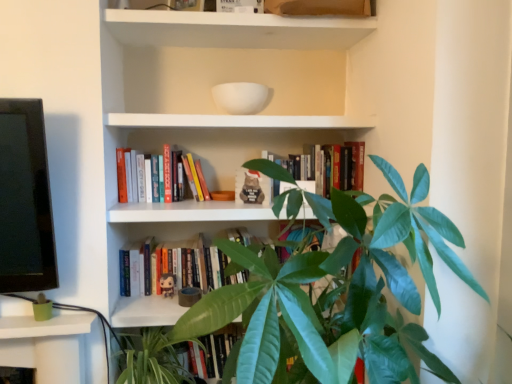
Describe the element at coordinates (333, 291) in the screenshot. I see `green glossy houseplant at center` at that location.

Find the location of `green leafy plant at lower center`. green leafy plant at lower center is located at coordinates click(151, 359).

At what (x,y) coordinates should I click in order to perform the action: click on green glossy houseplant at center. Please return your answer as a coordinate pair (x, y). Looking at the image, I should click on (333, 291).

Can you confirm if hardcover book at center, which is the 3th book from top to bottom, is taller than green glossy houseplant at center?

In fact, hardcover book at center, which is the 3th book from top to bottom, may be shorter than green glossy houseplant at center.

Is hardcover book at center, which is the 1th book in bottom-to-top order, not close to green glossy houseplant at center?

hardcover book at center, which is the 1th book in bottom-to-top order, is near green glossy houseplant at center, not far away.

Can you tell me how much hardcover book at center, which is the 3th book from top to bottom, and green glossy houseplant at center differ in facing direction?

88.2 degrees.

Is hardcover book at center, which is the 3th book from top to bottom, positioned before green glossy houseplant at center?

No, the depth of hardcover book at center, which is the 3th book from top to bottom, is greater than that of green glossy houseplant at center.

Considering the sizes of objects green leafy plant at lower center and green glossy houseplant at center in the image provided, who is shorter, green leafy plant at lower center or green glossy houseplant at center?

With less height is green leafy plant at lower center.

Is green leafy plant at lower center wider or thinner than green glossy houseplant at center?

Considering their sizes, green leafy plant at lower center looks slimmer than green glossy houseplant at center.

Would you consider green leafy plant at lower center to be distant from green glossy houseplant at center?

No.

Considering the points (161, 355) and (339, 325), which point is behind, point (161, 355) or point (339, 325)?

Positioned behind is point (161, 355).

Is hardcover books at center, which is counted as the second book, starting from the top, situated inside green leafy plant at lower center or outside?

hardcover books at center, which is counted as the second book, starting from the top, is not enclosed by green leafy plant at lower center.

Is hardcover books at center, which is the 2th book in bottom-to-top order, far from green leafy plant at lower center?

No.

Between hardcover books at center, which is counted as the second book, starting from the top, and green leafy plant at lower center, which one appears on the left side from the viewer's perspective?

hardcover books at center, which is counted as the second book, starting from the top, is more to the left.

Is green glossy houseplant at center oriented away from hardcover books at center, which is counted as the second book, starting from the top?

No, green glossy houseplant at center's orientation is not away from hardcover books at center, which is counted as the second book, starting from the top.

Between green glossy houseplant at center and hardcover books at center, which is the 2th book in bottom-to-top order, which one is positioned behind?

Positioned behind is hardcover books at center, which is the 2th book in bottom-to-top order.

Between green glossy houseplant at center and hardcover books at center, which is the 2th book in bottom-to-top order, which one has less height?

Standing shorter between the two is hardcover books at center, which is the 2th book in bottom-to-top order.

Which of these two, green glossy houseplant at center or hardcover books at center, which is the 2th book in bottom-to-top order, is bigger?

Bigger between the two is green glossy houseplant at center.

From a real-world perspective, which object rests below the other?

In real-world perspective, green glossy houseplant at center is lower.

Are hardcover books at center, positioned as the 3th book in bottom-to-top order, and green glossy houseplant at center located far from each other?

They are positioned close to each other.

The width and height of the screenshot is (512, 384). In order to click on houseplant that appears in front of the hardcover books at center, positioned as the 3th book in bottom-to-top order in this screenshot , I will do `click(333, 291)`.

Is hardcover book at center, which is the 3th book from top to bottom, completely or partially outside of green leafy plant at lower center?

hardcover book at center, which is the 3th book from top to bottom, lies outside green leafy plant at lower center's area.

Based on the photo, is hardcover book at center, which is the 1th book in bottom-to-top order, taller or shorter than green leafy plant at lower center?

Clearly, hardcover book at center, which is the 1th book in bottom-to-top order, is shorter compared to green leafy plant at lower center.

Where is `vegetation below the hardcover book at center, which is the 3th book from top to bottom (from a real-world perspective)`? This screenshot has width=512, height=384. vegetation below the hardcover book at center, which is the 3th book from top to bottom (from a real-world perspective) is located at coordinates (151, 359).

Is hardcover book at center, which is the 1th book in bottom-to-top order, aimed at green leafy plant at lower center?

No.

Does hardcover books at center, which is the 2th book in bottom-to-top order, touch green glossy houseplant at center?

No, hardcover books at center, which is the 2th book in bottom-to-top order, is not with green glossy houseplant at center.

Which point is more forward, (153, 180) or (419, 339)?

The point (419, 339) is closer to the camera.

Which of these two, hardcover books at center, which is counted as the second book, starting from the top, or green glossy houseplant at center, is bigger?

green glossy houseplant at center.

Is hardcover books at center, which is counted as the second book, starting from the top, in front of or behind green glossy houseplant at center in the image?

In the image, hardcover books at center, which is counted as the second book, starting from the top, appears behind green glossy houseplant at center.

I want to click on book that is the 3rd one when counting backward from the green glossy houseplant at center, so click(x=182, y=266).

Find the location of a particular element. The height and width of the screenshot is (384, 512). houseplant on the right of the green leafy plant at lower center is located at coordinates (333, 291).

When comparing their distances from green leafy plant at lower center, does hardcover books at center, which is counted as the second book, starting from the top, or green glossy houseplant at center seem further?

green glossy houseplant at center lies further to green leafy plant at lower center than the other object.

Which object lies further to the anchor point green glossy houseplant at center, hardcover book at center, which is the 1th book in bottom-to-top order, or green leafy plant at lower center?

green leafy plant at lower center lies further to green glossy houseplant at center than the other object.

Looking at the image, which one is located further to green leafy plant at lower center, hardcover book at center, which is the 1th book in bottom-to-top order, or hardcover books at center, which is the 2th book in bottom-to-top order?

hardcover books at center, which is the 2th book in bottom-to-top order.

Which object lies further to the anchor point hardcover book at center, which is the 3th book from top to bottom, hardcover books at center, acting as the first book starting from the top, or hardcover books at center, which is the 2th book in bottom-to-top order?

hardcover books at center, acting as the first book starting from the top, is positioned further to the anchor hardcover book at center, which is the 3th book from top to bottom.

When comparing their distances from hardcover books at center, positioned as the 3th book in bottom-to-top order, does hardcover book at center, which is the 1th book in bottom-to-top order, or hardcover books at center, which is the 2th book in bottom-to-top order, seem closer?

hardcover book at center, which is the 1th book in bottom-to-top order.

From the image, which object appears to be nearer to green leafy plant at lower center, hardcover books at center, acting as the first book starting from the top, or hardcover book at center, which is the 1th book in bottom-to-top order?

hardcover book at center, which is the 1th book in bottom-to-top order, is closer to green leafy plant at lower center.

From the image, which object appears to be nearer to hardcover book at center, which is the 1th book in bottom-to-top order, green glossy houseplant at center or hardcover books at center, which is the 2th book in bottom-to-top order?

hardcover books at center, which is the 2th book in bottom-to-top order, lies closer to hardcover book at center, which is the 1th book in bottom-to-top order, than the other object.

Looking at the image, which one is located closer to hardcover books at center, positioned as the 3th book in bottom-to-top order, green glossy houseplant at center or green leafy plant at lower center?

green glossy houseplant at center lies closer to hardcover books at center, positioned as the 3th book in bottom-to-top order, than the other object.

I want to click on book between green glossy houseplant at center and hardcover books at center, which is the 2th book in bottom-to-top order, along the z-axis, so click(332, 167).

Locate an element on the screen. vegetation between green glossy houseplant at center and hardcover books at center, acting as the first book starting from the top, along the z-axis is located at coordinates (151, 359).

The width and height of the screenshot is (512, 384). Find the location of `vegetation between green glossy houseplant at center and hardcover books at center, which is counted as the second book, starting from the top, along the z-axis`. vegetation between green glossy houseplant at center and hardcover books at center, which is counted as the second book, starting from the top, along the z-axis is located at coordinates (151, 359).

The height and width of the screenshot is (384, 512). I want to click on book that lies between hardcover books at center, which is counted as the second book, starting from the top, and green leafy plant at lower center from top to bottom, so click(182, 266).